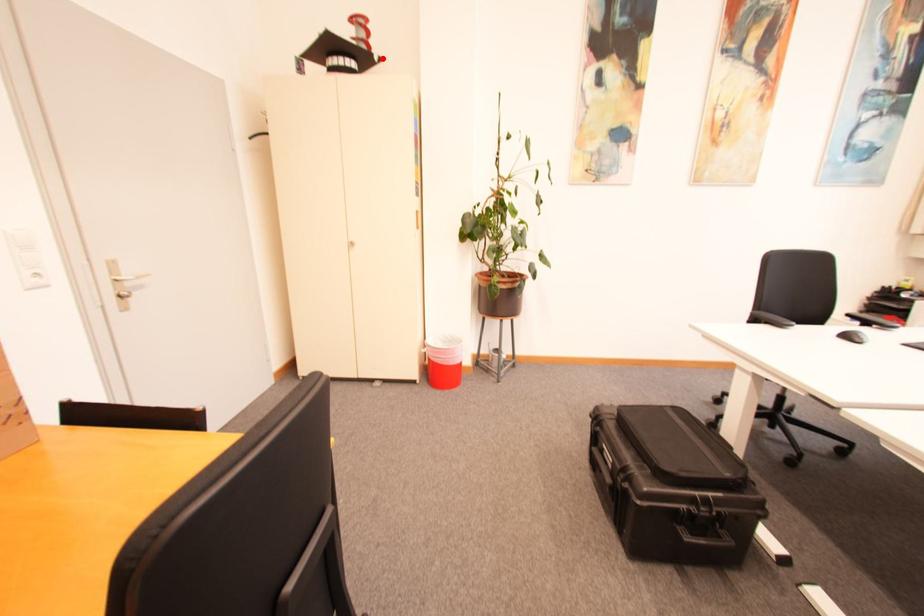
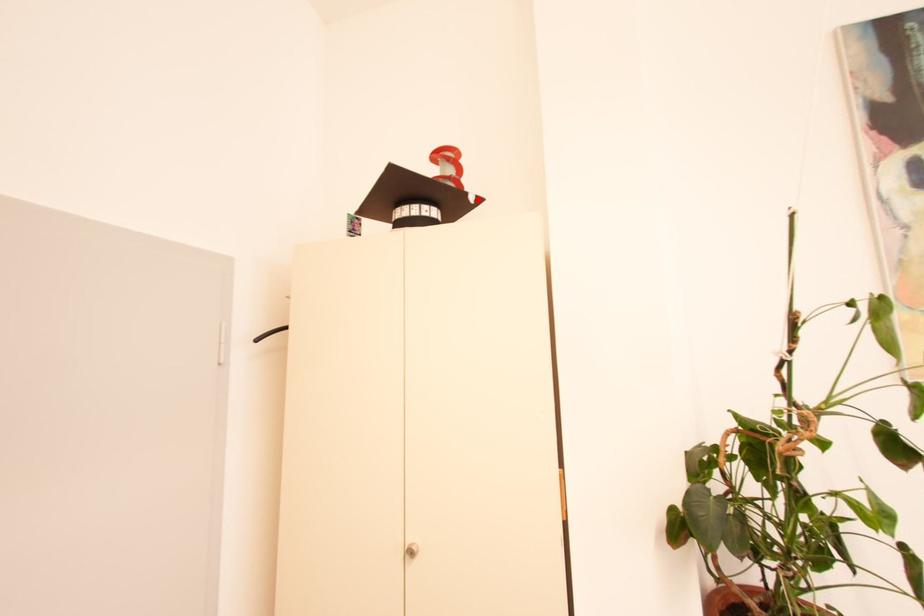
In the scene shown: I am providing you with two images of the same scene from different viewpoints. A red point is marked on the first image and another point is marked on the second image. Is the marked point in image1 the same physical position as the marked point in image2?

Yes